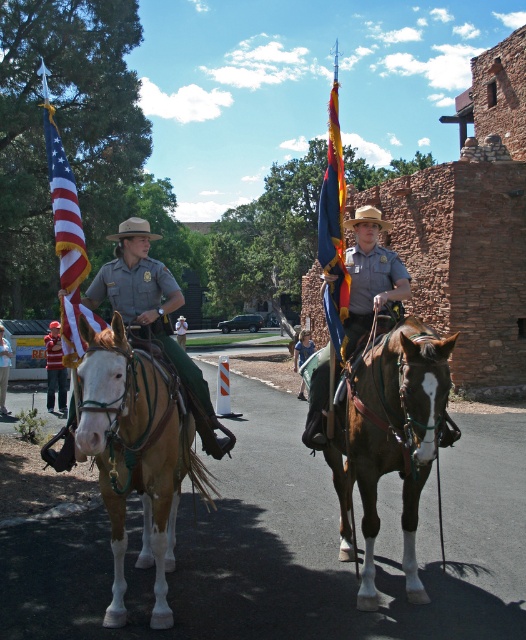
Does point (322, 410) lie in front of point (11, 348)?

Yes, it is in front of point (11, 348).

Is matte brown uniform at center positioned in front of brushed metal helmet at upper center?

Yes, matte brown uniform at center is in front of brushed metal helmet at upper center.

The width and height of the screenshot is (526, 640). What do you see at coordinates (361, 289) in the screenshot?
I see `matte brown uniform at center` at bounding box center [361, 289].

Image resolution: width=526 pixels, height=640 pixels. Identify the location of matte brown uniform at center. (361, 289).

Is light brown leather horse at left thinner than blue denim shirt at center?

Indeed, light brown leather horse at left has a lesser width compared to blue denim shirt at center.

Describe the element at coordinates (136, 451) in the screenshot. I see `light brown leather horse at left` at that location.

Find the location of a particular element. This screenshot has height=640, width=526. light brown leather horse at left is located at coordinates (136, 451).

Which of these two, matte brown uniform at center or american flag at left, stands shorter?

Standing shorter between the two is matte brown uniform at center.

Is matte brown uniform at center positioned behind american flag at left?

Yes, it is behind american flag at left.

Is point (356, 253) more distant than point (77, 253)?

Yes.

Locate an element on the screen. The image size is (526, 640). matte brown uniform at center is located at coordinates (361, 289).